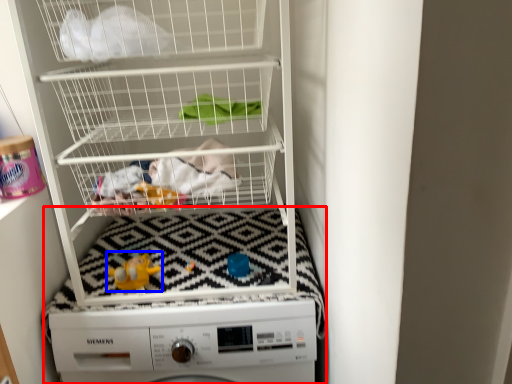
Question: Among these objects, which one is farthest to the camera, machine (highlighted by a red box) or toy (highlighted by a blue box)?

Choices:
 (A) machine
 (B) toy

Answer: (B)